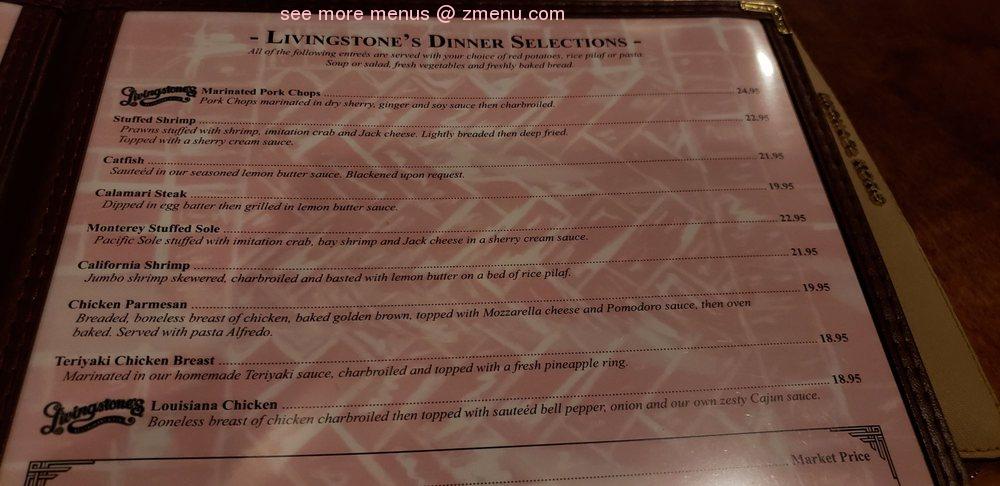
Find the location of a particular element. table is located at coordinates (885, 131).